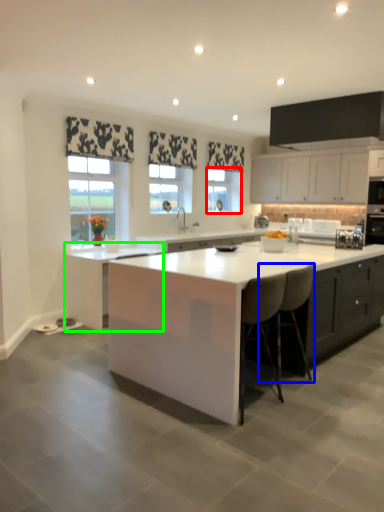
Question: Which is nearer to the window (highlighted by a red box)? chair (highlighted by a blue box) or cabinetry (highlighted by a green box).

Choices:
 (A) chair
 (B) cabinetry

Answer: (B)